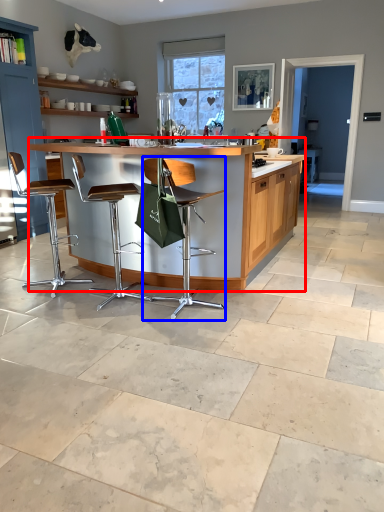
Question: Which of the following is the farthest to the observer, table (highlighted by a red box) or chair (highlighted by a blue box)?

Choices:
 (A) table
 (B) chair

Answer: (A)